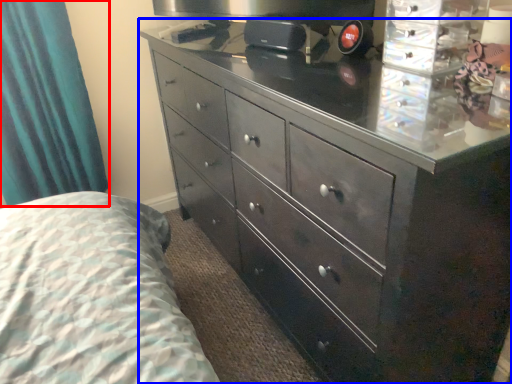
Question: Which object appears farthest to the camera in this image, curtain (highlighted by a red box) or chest of drawers (highlighted by a blue box)?

Choices:
 (A) curtain
 (B) chest of drawers

Answer: (A)